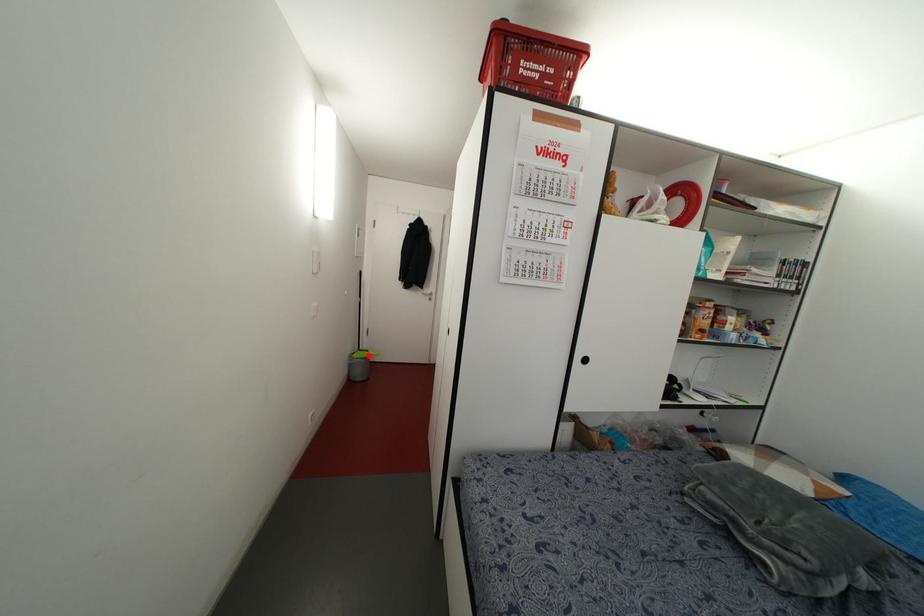
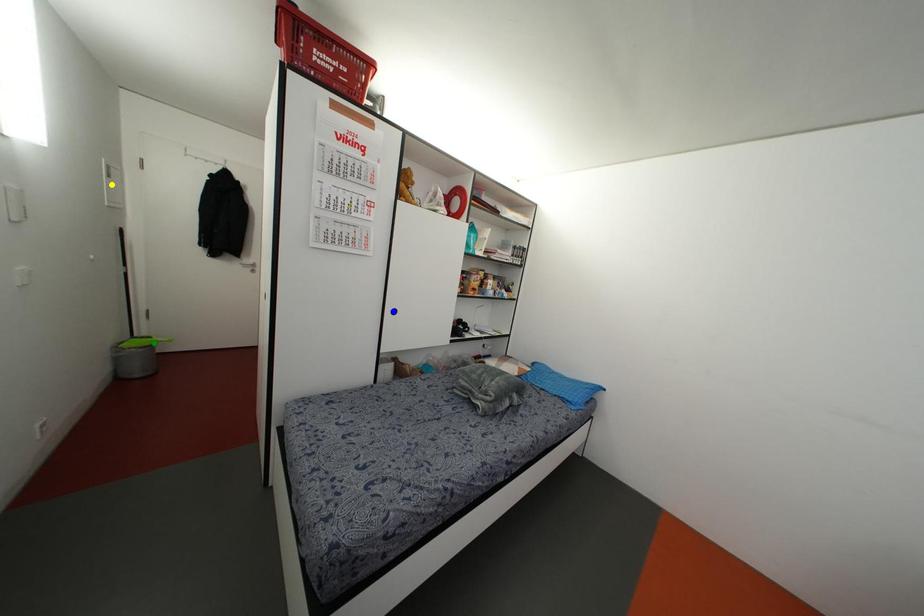
Question: I am providing you with two images of the same scene from different viewpoints. A red point is marked on the first image. You are given multiple points on the second image. In image 2, which mark is for the same physical point as the one in image 1?

Choices:
 (A) yellow point
 (B) green point
 (C) blue point

Answer: (B)